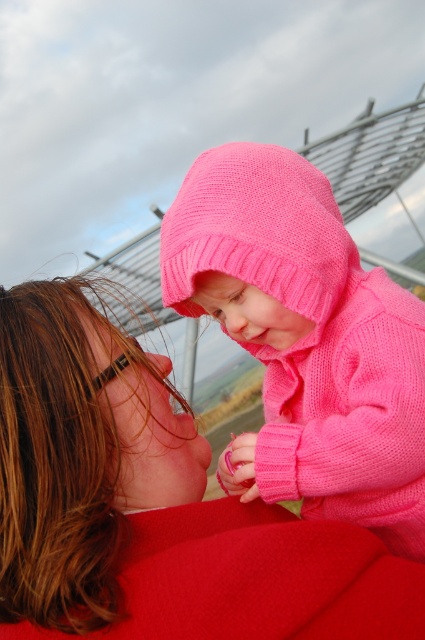
Which is below, matte pink sweater at upper center or knitted pink sweater at center?

matte pink sweater at upper center is lower down.

Can you confirm if matte pink sweater at upper center is thinner than knitted pink sweater at center?

In fact, matte pink sweater at upper center might be wider than knitted pink sweater at center.

Who is more forward, (53,454) or (408,404)?

Positioned in front is point (53,454).

Identify the location of matte pink sweater at upper center. (153, 506).